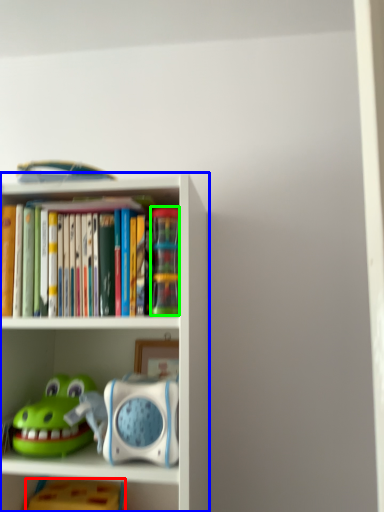
Question: Estimate the real-world distances between objects in this image. Which object is closer to toy (highlighted by a red box), shelf (highlighted by a blue box) or toy (highlighted by a green box)?

Choices:
 (A) shelf
 (B) toy

Answer: (A)